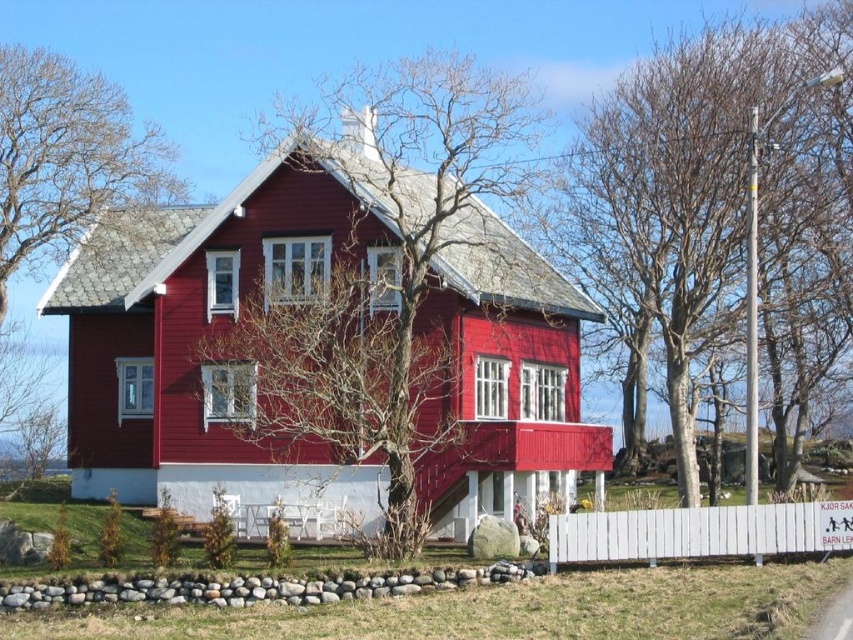
You are a bird looking for a place to perch. You see two sets of branches in the upper part of the image. Which one is narrower between the bare branches at upper center and the bare branches at upper left?

The bare branches at upper center has a lesser width compared to the bare branches at upper left, so it is narrower.

You are standing in the yard of the house and want to walk from the white wooden fence at lower right to the bare wood tree at center. Which direction should you face to walk directly towards the tree?

You should face to the left since the bare wood tree at center is to the left of the white wooden fence at lower right.

You are standing in front of the two story house and notice two sets of bare branches in the upper part of the image. Which of the two, the bare branches at upper center or the bare branches at upper left, is larger in size?

The bare branches at upper center is bigger than the bare branches at upper left.